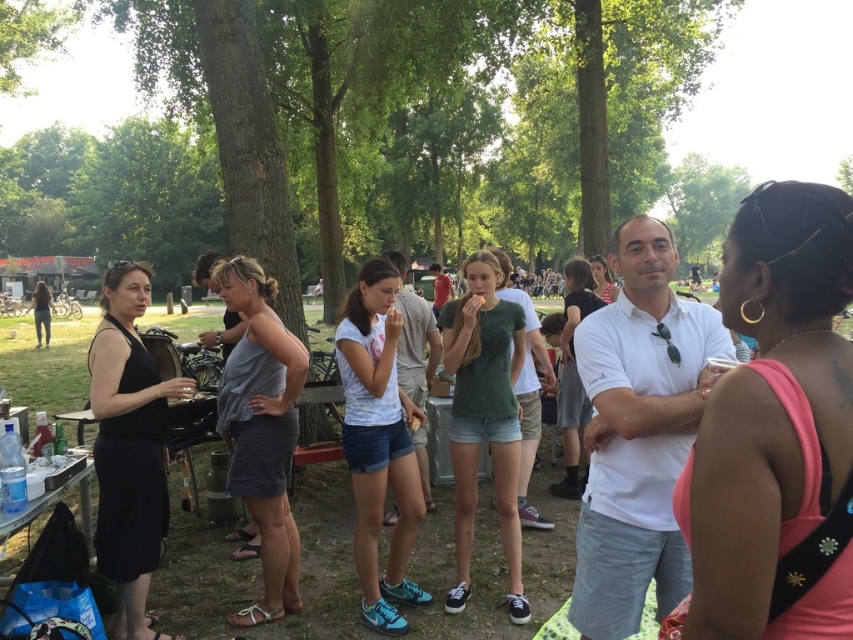
Question: Does pink fabric top at center appear on the right side of white matte shirt at center?

Choices:
 (A) no
 (B) yes

Answer: (B)

Question: Which of the following is the farthest from the observer?

Choices:
 (A) green matte t-shirt at center
 (B) white matte shirt at center
 (C) gray fabric dress at center
 (D) black matte dress at left

Answer: (A)

Question: Can you confirm if white matte shirt at center is positioned above green matte t-shirt at center?

Choices:
 (A) yes
 (B) no

Answer: (A)

Question: Among these points, which one is nearest to the camera?

Choices:
 (A) (497, 301)
 (B) (807, 225)

Answer: (B)

Question: Is gray fabric dress at center to the left of green matte t-shirt at center from the viewer's perspective?

Choices:
 (A) no
 (B) yes

Answer: (B)

Question: Among these objects, which one is farthest from the camera?

Choices:
 (A) white matte shirt at center
 (B) black matte dress at left
 (C) pink fabric top at center

Answer: (A)